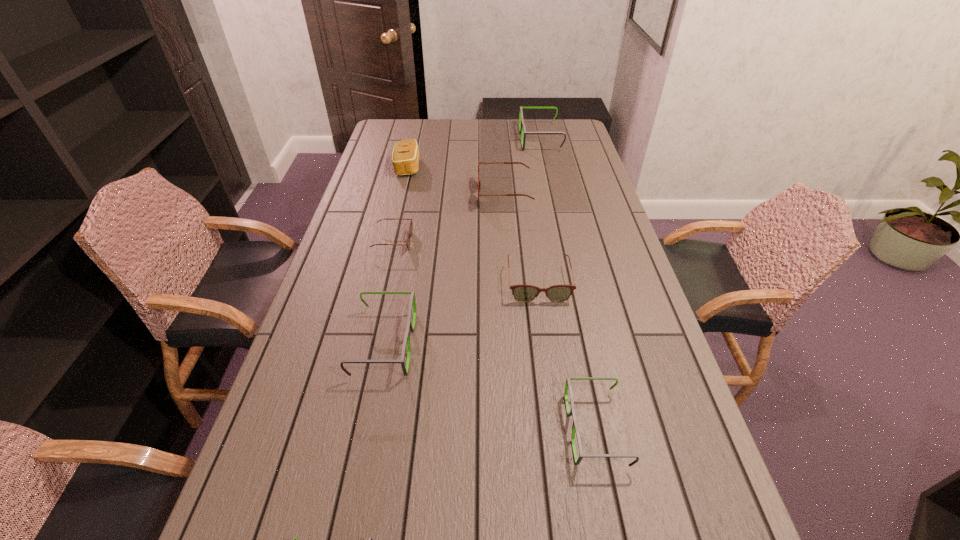
You are a GUI agent. You are given a task and a screenshot of the screen. Output one action in this format:
    pyautogui.click(x=<x>, y=<y>)
    Task: Click on the second nearest object
    The image size is (960, 540).
    Given the screenshot: What is the action you would take?
    pyautogui.click(x=568, y=384)

Find the location of a particular element. the second nearest black spectacles is located at coordinates (568, 384).

Locate an element on the screen. the second nearest brown spectacles is located at coordinates (410, 233).

You are a GUI agent. You are given a task and a screenshot of the screen. Output one action in this format:
    pyautogui.click(x=<x>, y=<y>)
    Task: Click on the leftmost brown spectacles
    This screenshot has height=540, width=960.
    Given the screenshot: What is the action you would take?
    pyautogui.click(x=410, y=233)

Where is `free spot located on the lens of the farthest object`? Image resolution: width=960 pixels, height=540 pixels. free spot located on the lens of the farthest object is located at coordinates (493, 138).

Find the location of a particular element. vacant space located on the lens of the farthest object is located at coordinates (500, 138).

This screenshot has height=540, width=960. What are the coordinates of `vacant space located on the lens of the farthest object` in the screenshot? It's located at (467, 138).

Locate an element on the screen. free space located on the zipper side of the clutch bag is located at coordinates (463, 167).

Find the location of a particular element. This screenshot has height=540, width=960. free space located 0.090m at the front view of the sixth nearest object is located at coordinates (453, 195).

Where is `free spot located at the front view of the sixth nearest object`? The width and height of the screenshot is (960, 540). free spot located at the front view of the sixth nearest object is located at coordinates (399, 195).